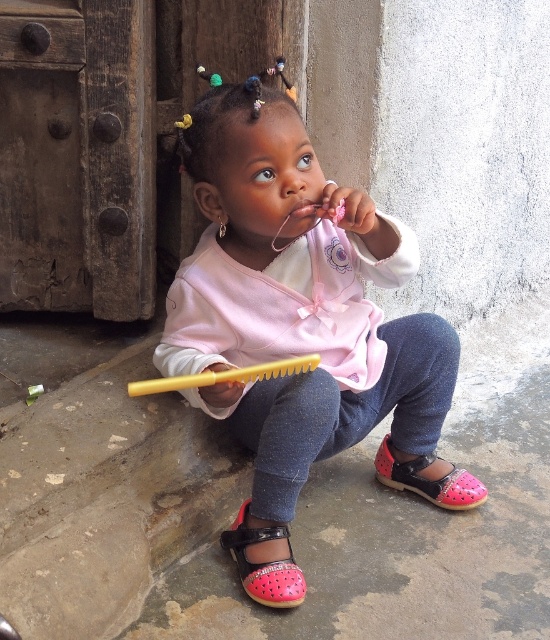
Is pink fabric at center taller than pink leather sandal at lower center?

Yes, pink fabric at center is taller than pink leather sandal at lower center.

Is point (271, 269) closer to camera compared to point (264, 582)?

No, (271, 269) is further to viewer.

You are a GUI agent. You are given a task and a screenshot of the screen. Output one action in this format:
    pyautogui.click(x=<x>, y=<y>)
    Task: Click on the pink fabric at center
    The height and width of the screenshot is (640, 550).
    Given the screenshot: What is the action you would take?
    pyautogui.click(x=294, y=317)

Between pink leather sandal at lower right and yellow plastic brush at lower center, which one appears on the right side from the viewer's perspective?

Positioned to the right is pink leather sandal at lower right.

Which is in front, point (470, 483) or point (255, 365)?

Positioned in front is point (255, 365).

Is point (390, 458) behind point (264, 376)?

Yes, it is.

Where is `pink leather sandal at lower right`? pink leather sandal at lower right is located at coordinates (429, 480).

Can you confirm if pink leather sandal at lower center is positioned below pink glossy lips at center?

Correct, pink leather sandal at lower center is located below pink glossy lips at center.

Which of these two, pink leather sandal at lower center or pink glossy lips at center, stands taller?

pink leather sandal at lower center

Is point (302, 592) positioned in front of point (306, 216)?

No, it is not.

Find the location of a particular element. This screenshot has width=550, height=640. pink leather sandal at lower center is located at coordinates (264, 563).